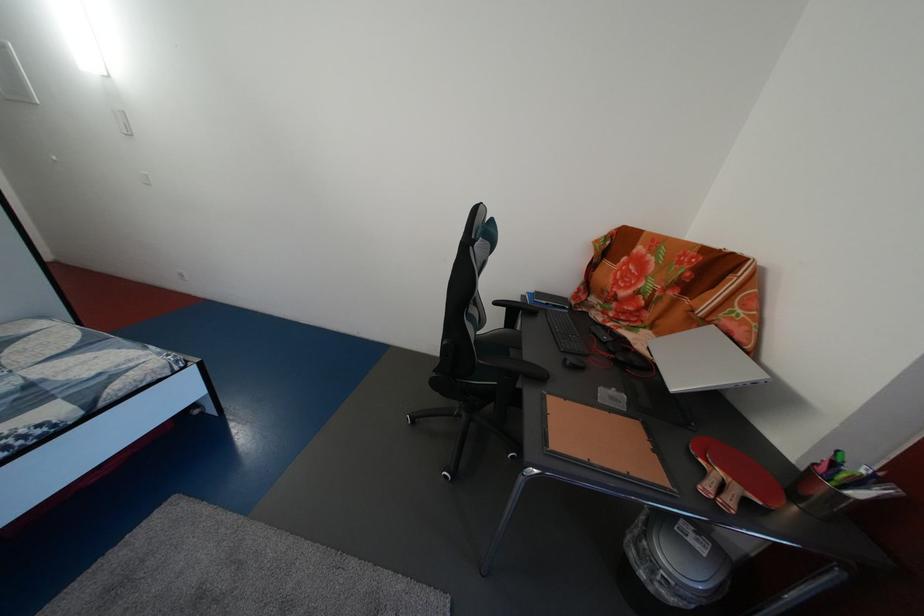
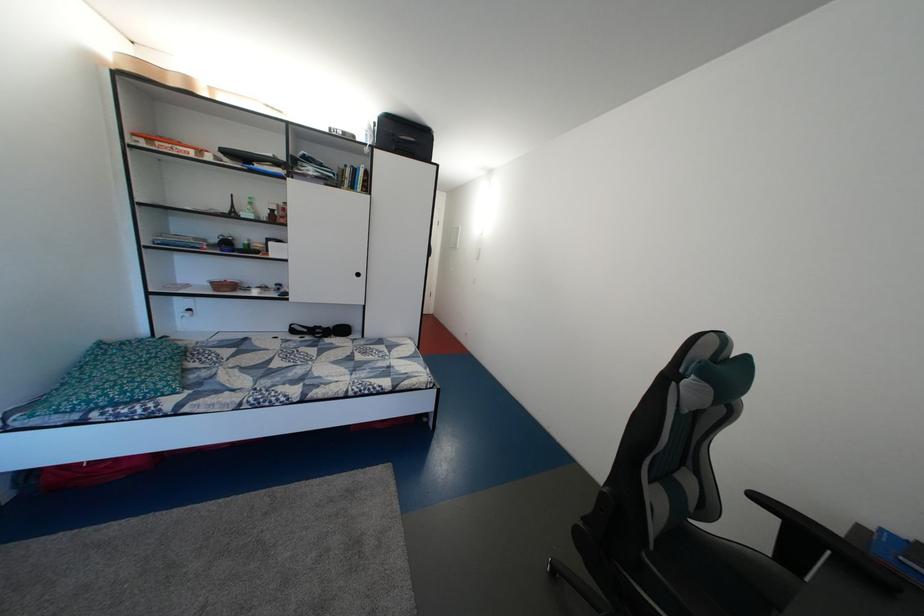
The point at [506,310] is marked in the first image. Where is the corresponding point in the second image?

(768, 504)